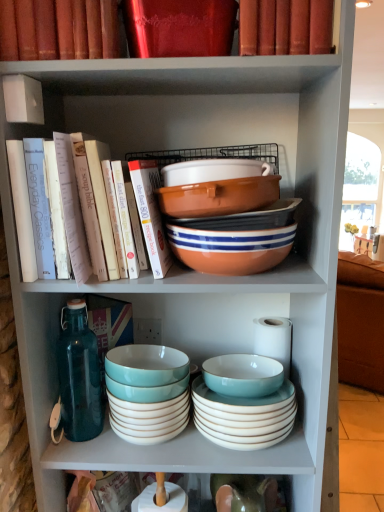
Question: In which direction should I rotate to look at shiny red book at upper center, which appears as the second book when ordered from the bottom?

Choices:
 (A) left
 (B) right

Answer: (A)

Question: Is matte red book at upper center, marked as the fourth book in a bottom-to-top arrangement, facing towards teal glossy bowl at center, the third bowl ordered from the bottom?

Choices:
 (A) no
 (B) yes

Answer: (A)

Question: Does matte red book at upper center, placed as the 1th book when sorted from top to bottom, appear on the left side of teal glossy bowl at center, the third bowl ordered from the bottom?

Choices:
 (A) no
 (B) yes

Answer: (B)

Question: Can you confirm if matte red book at upper center, marked as the fourth book in a bottom-to-top arrangement, is bigger than teal glossy bowl at center, the third bowl ordered from the bottom?

Choices:
 (A) yes
 (B) no

Answer: (A)

Question: Does matte red book at upper center, placed as the 1th book when sorted from top to bottom, have a smaller size compared to teal glossy bowl at center, the 5th bowl positioned from the top?

Choices:
 (A) yes
 (B) no

Answer: (B)

Question: Is matte red book at upper center, marked as the fourth book in a bottom-to-top arrangement, oriented away from teal glossy bowl at center, the 5th bowl positioned from the top?

Choices:
 (A) yes
 (B) no

Answer: (B)

Question: Considering the relative sizes of matte red book at upper center, placed as the 1th book when sorted from top to bottom, and teal glossy bowl at center, the third bowl ordered from the bottom, in the image provided, is matte red book at upper center, placed as the 1th book when sorted from top to bottom, shorter than teal glossy bowl at center, the third bowl ordered from the bottom,?

Choices:
 (A) no
 (B) yes

Answer: (A)

Question: Could matte orange bowl at center, positioned as the seventh bowl in bottom-to-top order, be considered to be inside matte red book at upper center, marked as the fourth book in a bottom-to-top arrangement?

Choices:
 (A) yes
 (B) no

Answer: (B)

Question: Would you consider matte red book at upper center, marked as the fourth book in a bottom-to-top arrangement, to be distant from matte orange bowl at center, which is counted as the first bowl, starting from the top?

Choices:
 (A) yes
 (B) no

Answer: (B)

Question: Does matte red book at upper center, placed as the 1th book when sorted from top to bottom, have a lesser width compared to matte orange bowl at center, positioned as the seventh bowl in bottom-to-top order?

Choices:
 (A) yes
 (B) no

Answer: (B)

Question: From the image's perspective, is matte red book at upper center, placed as the 1th book when sorted from top to bottom, above matte orange bowl at center, positioned as the seventh bowl in bottom-to-top order?

Choices:
 (A) yes
 (B) no

Answer: (A)

Question: Could you tell me if matte red book at upper center, placed as the 1th book when sorted from top to bottom, is facing matte orange bowl at center, which is counted as the first bowl, starting from the top?

Choices:
 (A) no
 (B) yes

Answer: (A)

Question: From a real-world perspective, is matte red book at upper center, placed as the 1th book when sorted from top to bottom, on matte orange bowl at center, which is counted as the first bowl, starting from the top?

Choices:
 (A) no
 (B) yes

Answer: (B)

Question: From the image's perspective, is matte ceramic bowl at center, the fifth bowl positioned from the bottom, on top of matte ceramic bowl at lower center, the 2th bowl from the bottom?

Choices:
 (A) no
 (B) yes

Answer: (B)